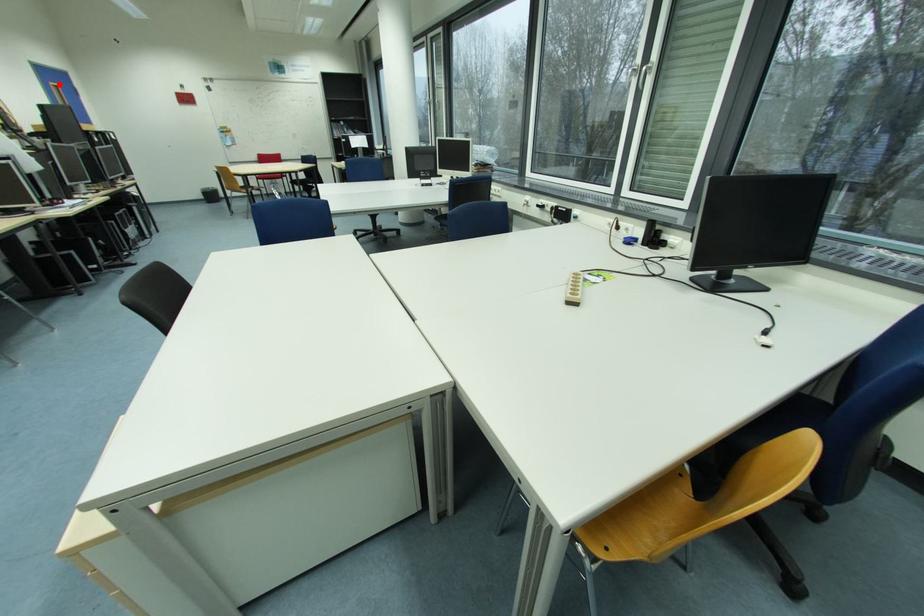
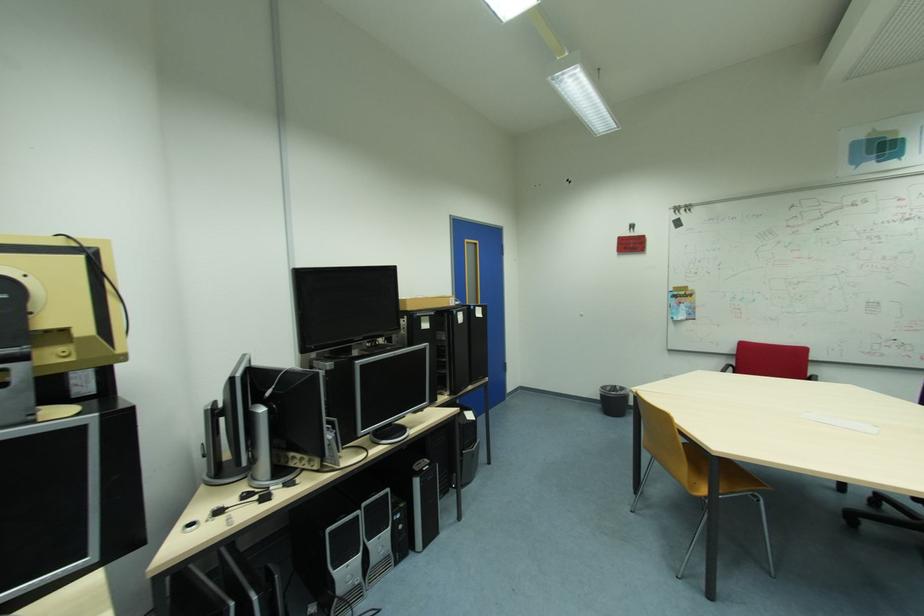
Question: I am providing you with two images of the same scene from different viewpoints. Given a red point in image1, look at the same physical point in image2. Is it:

Choices:
 (A) Closer to the viewpoint
 (B) Farther from the viewpoint

Answer: (A)